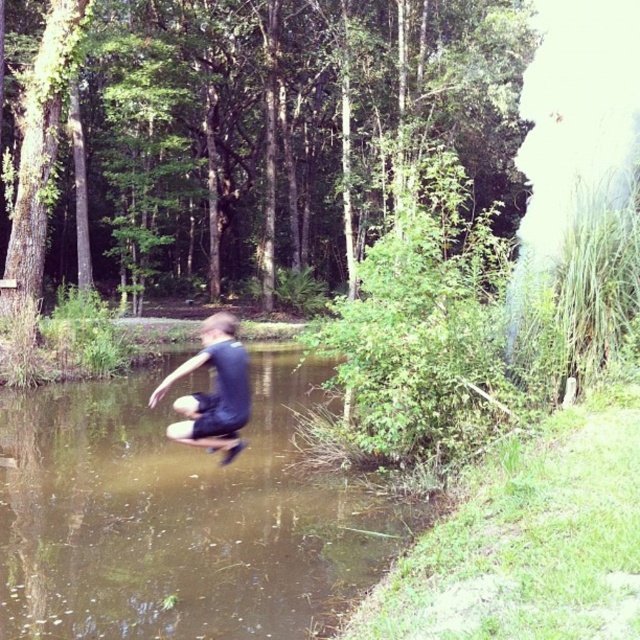
Who is positioned more to the left, brown murky water at center or dark blue fabric boy at center?

From the viewer's perspective, dark blue fabric boy at center appears more on the left side.

Is brown murky water at center to the right of dark blue fabric boy at center from the viewer's perspective?

Correct, you'll find brown murky water at center to the right of dark blue fabric boy at center.

Between point (1, 413) and point (202, 420), which one is positioned in front?

Point (202, 420) is more forward.

You are a GUI agent. You are given a task and a screenshot of the screen. Output one action in this format:
    pyautogui.click(x=<x>, y=<y>)
    Task: Click on the brown murky water at center
    
    Given the screenshot: What is the action you would take?
    pyautogui.click(x=179, y=516)